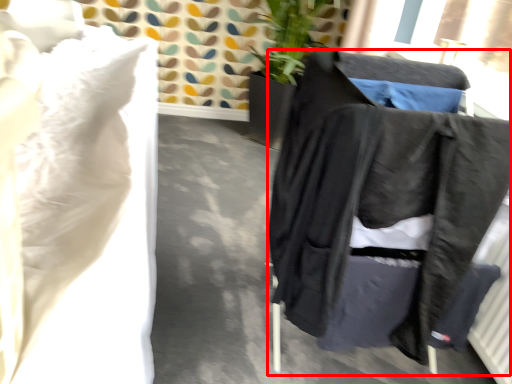
Question: Considering the relative positions of furniture (annotated by the red box) and sheet in the image provided, where is furniture (annotated by the red box) located with respect to the staircase?

Choices:
 (A) right
 (B) left

Answer: (A)